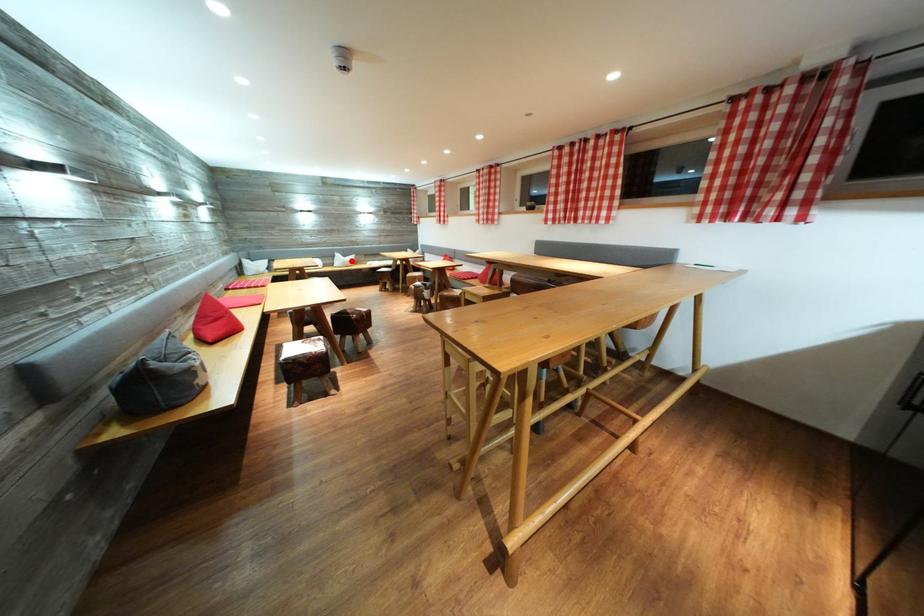
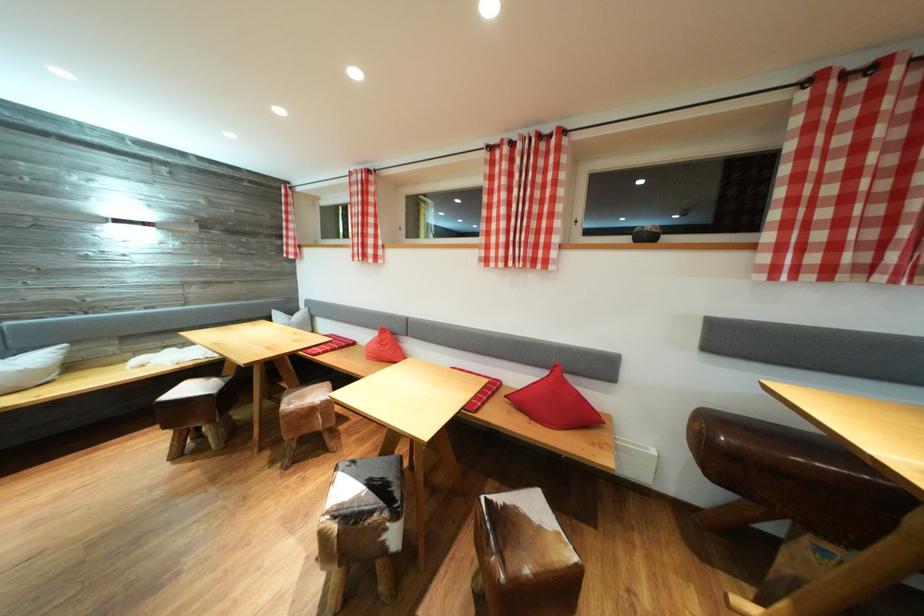
Locate, in the second image, the point that corresponds to the highlighted location in the first image.

(14, 358)